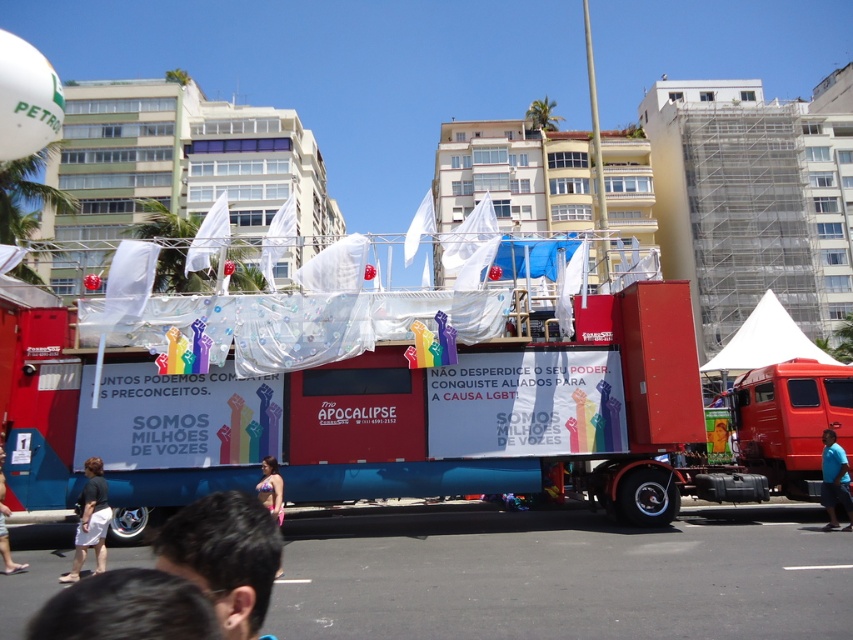
Who is higher up, white fabric canopy at center or blue t-shirt at lower right?

white fabric canopy at center

From the picture: Between white fabric canopy at center and blue t-shirt at lower right, which one has less height?

With less height is blue t-shirt at lower right.

Find the location of `white fabric canopy at center`. white fabric canopy at center is located at coordinates (764, 340).

Can you confirm if white cotton shorts at lower left is shorter than green fabric person at center?

In fact, white cotton shorts at lower left may be taller than green fabric person at center.

Is point (3, 547) closer to viewer compared to point (721, 433)?

Yes, it is in front of point (721, 433).

Locate an element on the screen. The width and height of the screenshot is (853, 640). white cotton shorts at lower left is located at coordinates (4, 525).

Image resolution: width=853 pixels, height=640 pixels. I want to click on white fabric canopy at center, so click(x=764, y=340).

Is the position of white fabric canopy at center more distant than that of white cotton shorts at lower left?

Yes, it is.

Find the location of a particular element. white fabric canopy at center is located at coordinates (764, 340).